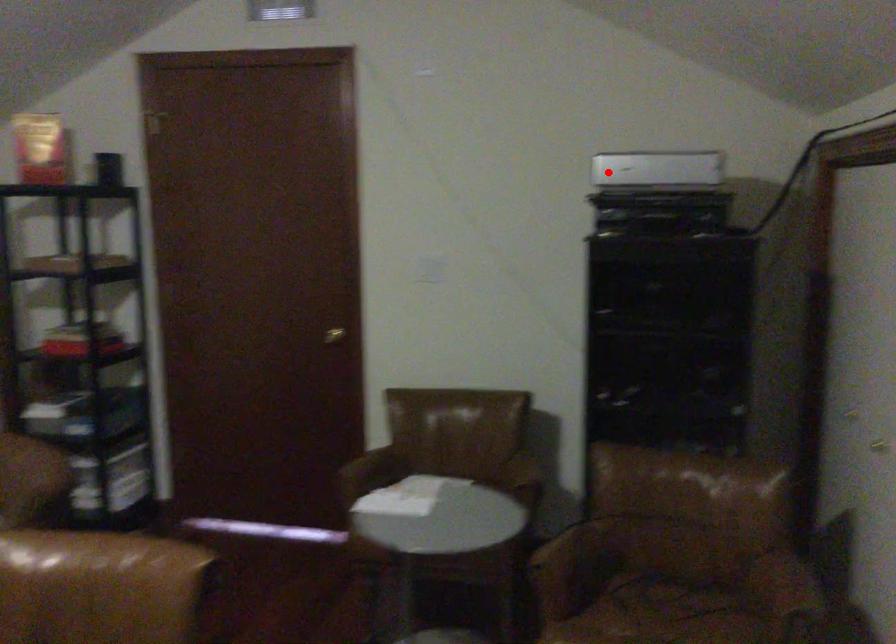
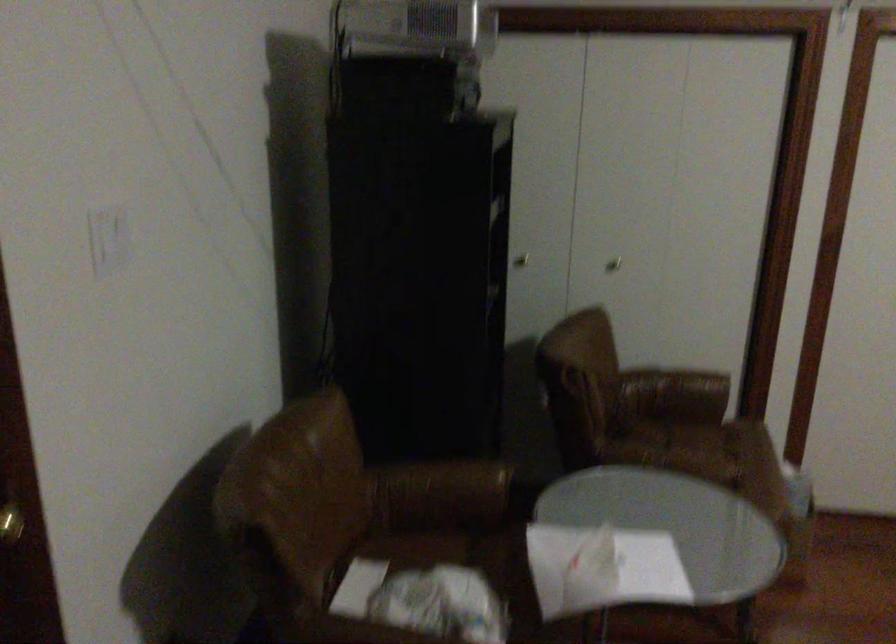
Question: A red point is marked in image1. In image2, is the corresponding 3D point closer to the camera or farther? Reply with the corresponding letter.

Choices:
 (A) The corresponding 3D point is closer.
 (B) The corresponding 3D point is farther.

Answer: (A)